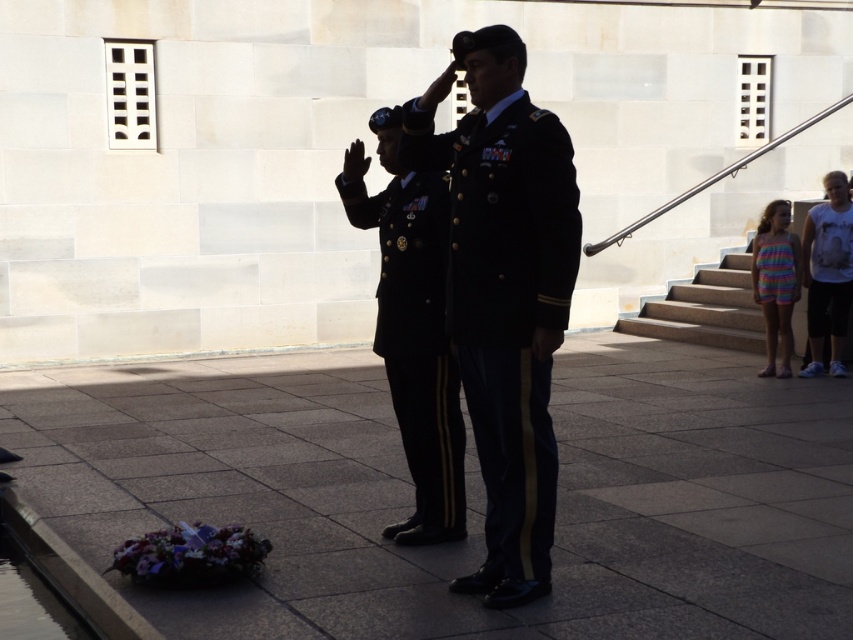
You are a photographer at a formal event. You need to capture a photo of both the black uniform at center and the shiny dark blue uniform at center. Based on their positions, which uniform is taller?

The black uniform at center is taller than the shiny dark blue uniform at center.

You are a photographer at the event and need to position yourself so that both the black uniform at center and the shiny dark blue uniform at center are visible in your shot. Which side should you stand relative to the uniforms to ensure both are in frame?

You should position yourself to the left of both uniforms because the black uniform at center is to the right of the shiny dark blue uniform at center, so standing left would allow you to capture both in the frame.